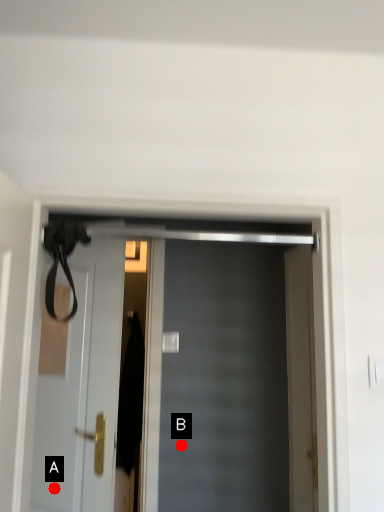
Question: Two points are circled on the image, labeled by A and B beside each circle. Among these points, which one is farthest from the camera?

Choices:
 (A) A is further
 (B) B is further

Answer: (B)